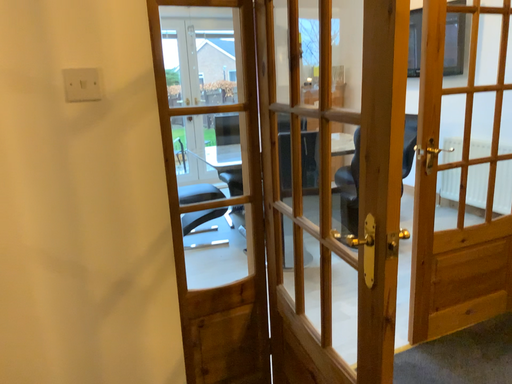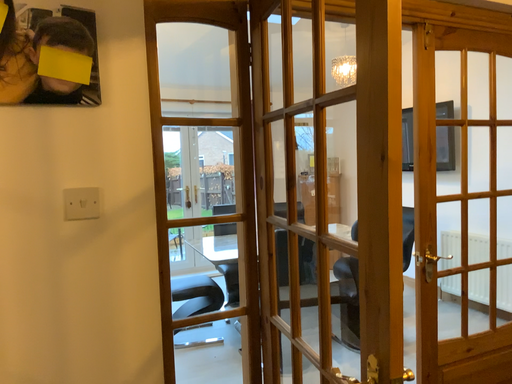
Question: Which way did the camera rotate in the video?

Choices:
 (A) rotated upward
 (B) rotated downward

Answer: (A)